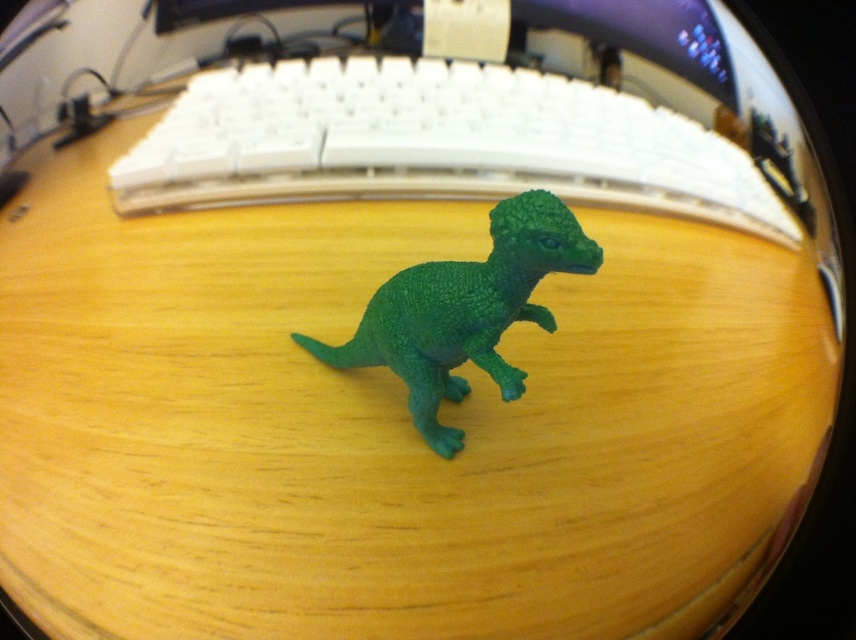
Question: Which of the following is the closest to the observer?

Choices:
 (A) (506, 392)
 (B) (209, 176)

Answer: (A)

Question: Among these objects, which one is nearest to the camera?

Choices:
 (A) green matte plastic dinosaur at center
 (B) white plastic keyboard at center

Answer: (A)

Question: Can you confirm if white plastic keyboard at center is bigger than green matte plastic dinosaur at center?

Choices:
 (A) yes
 (B) no

Answer: (A)

Question: Is white plastic keyboard at center thinner than green matte plastic dinosaur at center?

Choices:
 (A) yes
 (B) no

Answer: (B)

Question: Which object appears farthest from the camera in this image?

Choices:
 (A) green matte plastic dinosaur at center
 (B) white plastic keyboard at center

Answer: (B)

Question: Is white plastic keyboard at center to the right of green matte plastic dinosaur at center from the viewer's perspective?

Choices:
 (A) yes
 (B) no

Answer: (A)